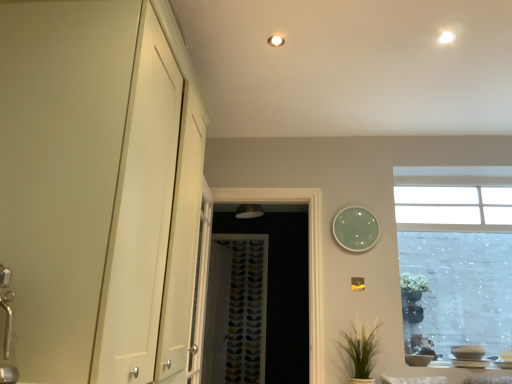
Question: Based on their positions, is white glossy light fixture at upper center, positioned as the 1th lighting in left-to-right order, located to the left or right of multicolored fabric curtain at center?

Choices:
 (A) left
 (B) right

Answer: (B)

Question: Based on their sizes in the image, would you say white glossy light fixture at upper center, placed as the second lighting when sorted from front to back, is bigger or smaller than multicolored fabric curtain at center?

Choices:
 (A) small
 (B) big

Answer: (A)

Question: Based on their relative distances, which object is nearer to the white glossy cabinet at left?

Choices:
 (A) white glossy light fixture at upper right, which is the 1th lighting in front-to-back order
 (B) patterned fabric screen door at center
 (C) multicolored fabric curtain at center
 (D) white glossy light fixture at upper center, positioned as the 1th lighting in left-to-right order
 (E) green glass clock at upper right

Answer: (D)

Question: Which is farther from the patterned fabric screen door at center?

Choices:
 (A) multicolored fabric curtain at center
 (B) white glossy light fixture at upper center, the first lighting from the back
 (C) green glass clock at upper right
 (D) white glossy cabinet at left
 (E) green matte plant at lower right

Answer: (D)